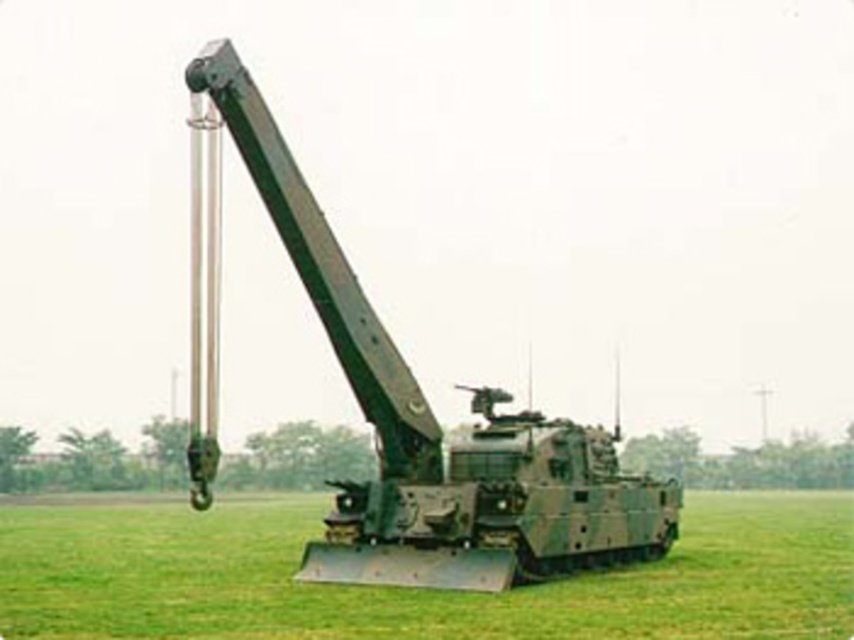
Who is more forward, (x=186, y=593) or (x=595, y=499)?

Point (x=186, y=593) is more forward.

Find the location of `green matte grass at center`. green matte grass at center is located at coordinates (414, 588).